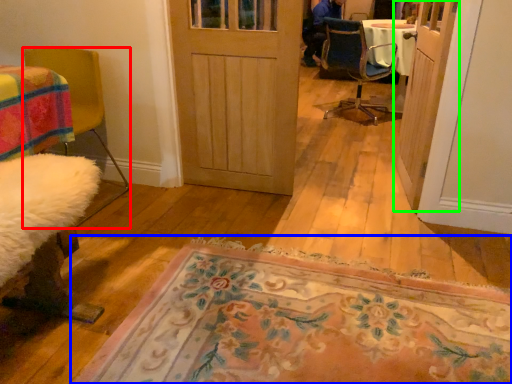
Question: Estimate the real-world distances between objects in this image. Which object is closer to chair (highlighted by a red box), mat (highlighted by a blue box) or door (highlighted by a green box)?

Choices:
 (A) mat
 (B) door

Answer: (A)